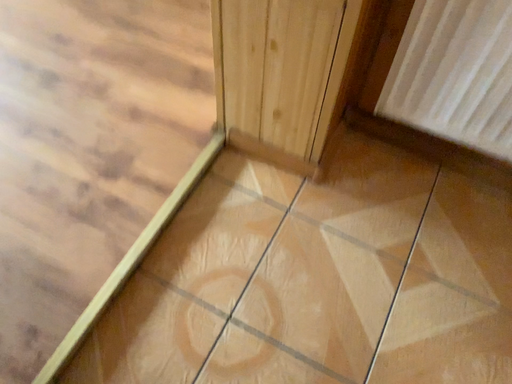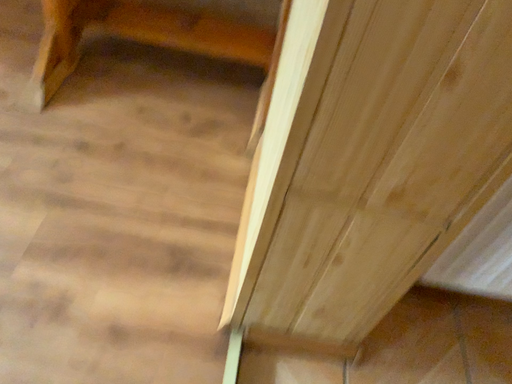
Question: Which way did the camera rotate in the video?

Choices:
 (A) rotated downward
 (B) rotated upward

Answer: (B)